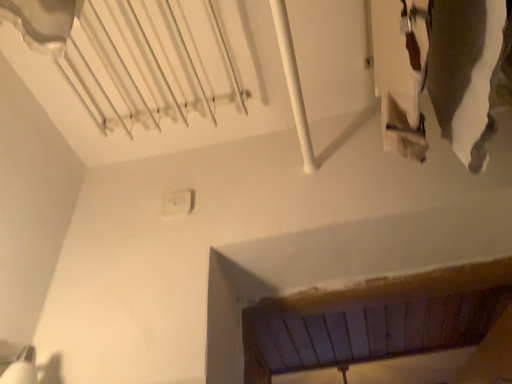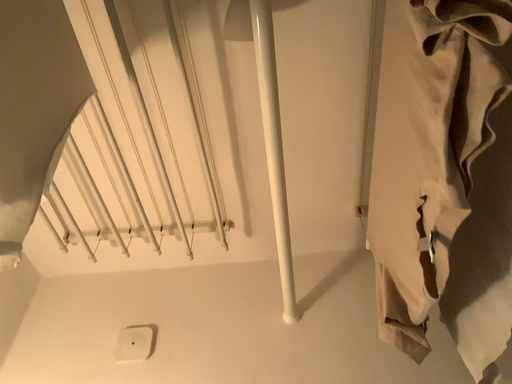
Question: Which way did the camera rotate in the video?

Choices:
 (A) rotated downward
 (B) rotated upward

Answer: (B)